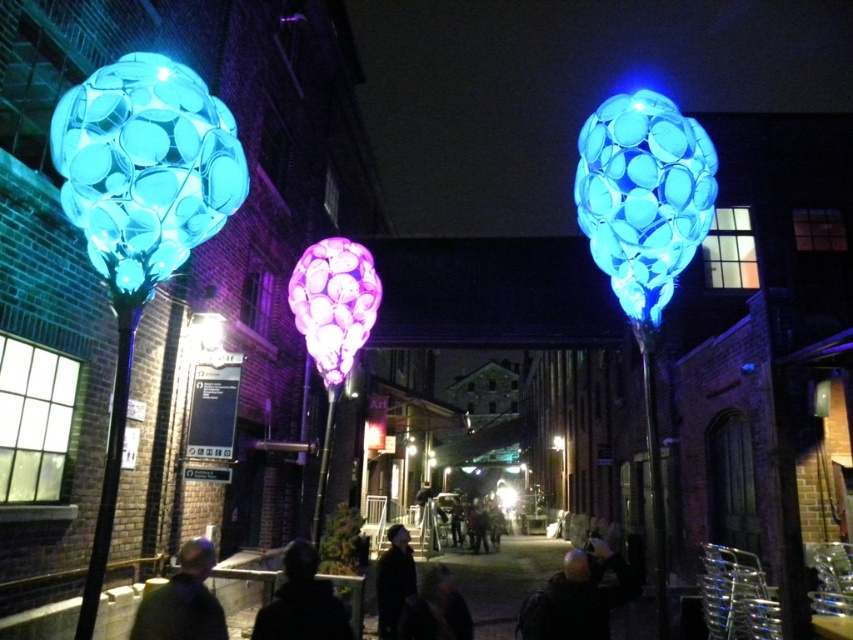
You are a photographer trying to capture the scene with the dark hair at center and dark fabric jacket at center. Which object should you focus on first if you want to ensure both are in sharp focus?

You should focus on the dark fabric jacket at center first because it is closer to you than the dark hair at center, which is further away.

You are standing in the alleyway and notice a person with dark hair at lower center. If you want to take a photo of their hair, which direction should you move to get a better angle?

Since the dark hair at lower center is located at point (577,596), you should move to the right to get a better angle.